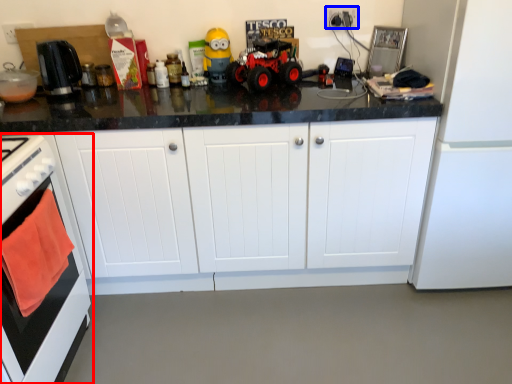
Question: Which of the following is the closest to the observer, home appliance (highlighted by a red box) or electric outlet (highlighted by a blue box)?

Choices:
 (A) home appliance
 (B) electric outlet

Answer: (A)